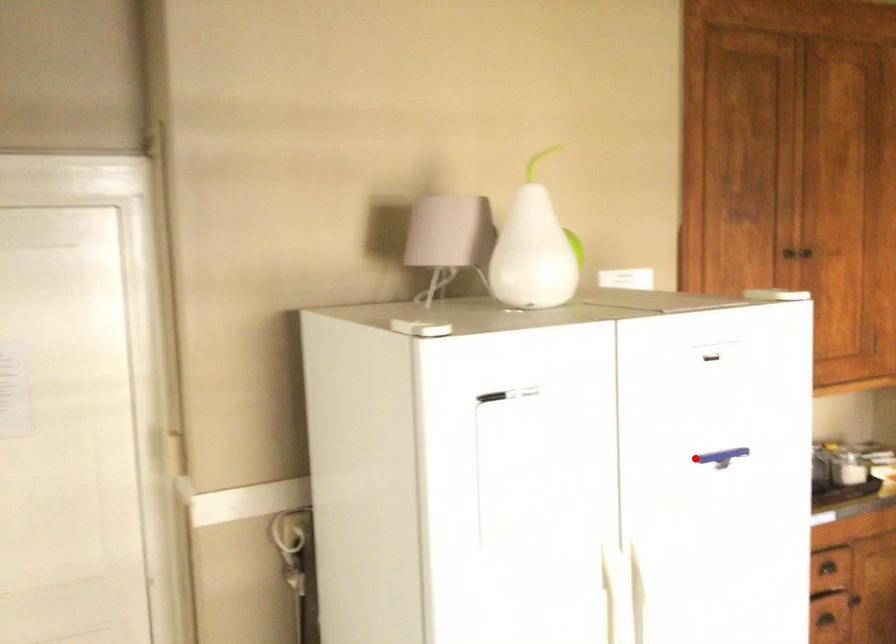
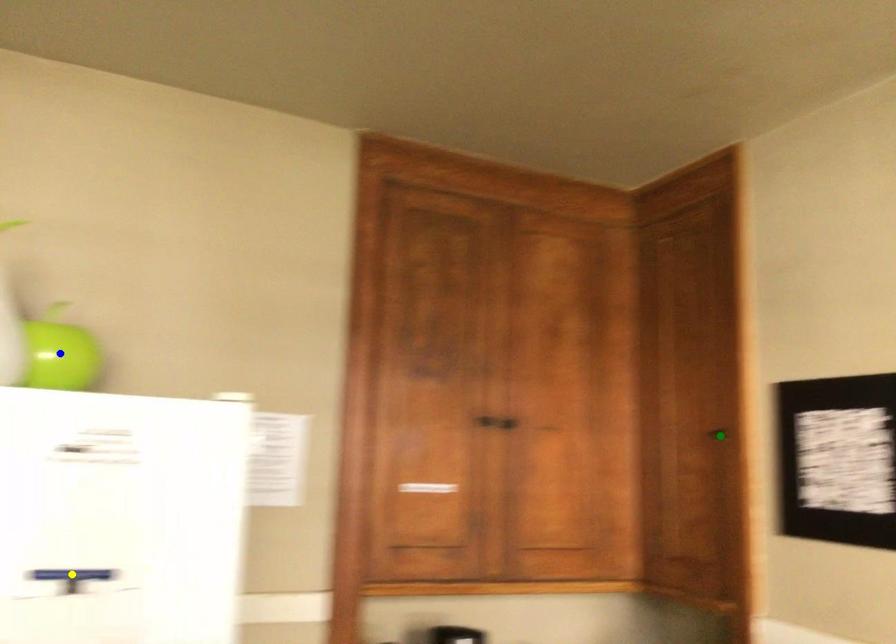
Question: I am providing you with two images of the same scene from different viewpoints. A red point is marked on the first image. You are given multiple points on the second image. Can you choose the point in image 2 that corresponds to the point in image 1?

Choices:
 (A) blue point
 (B) yellow point
 (C) green point

Answer: (B)